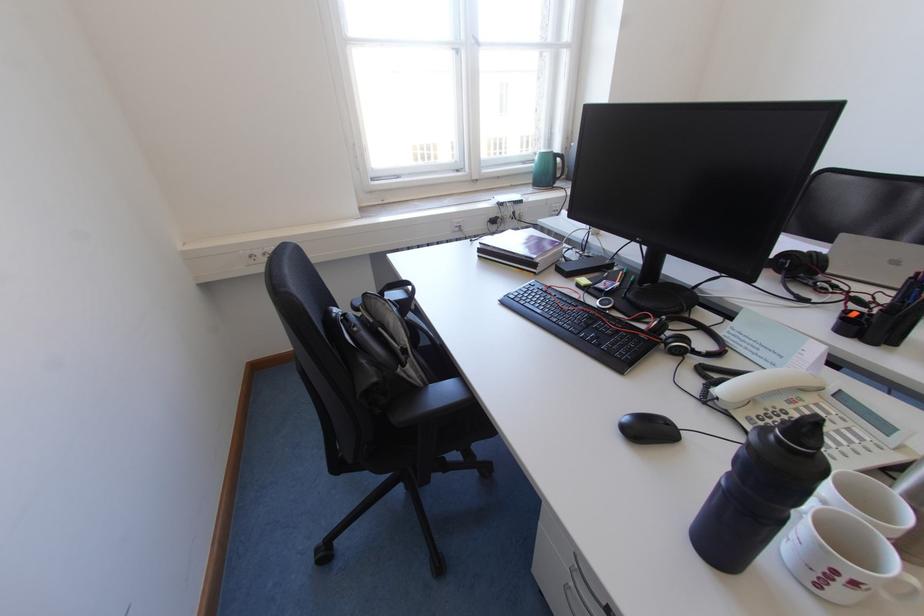
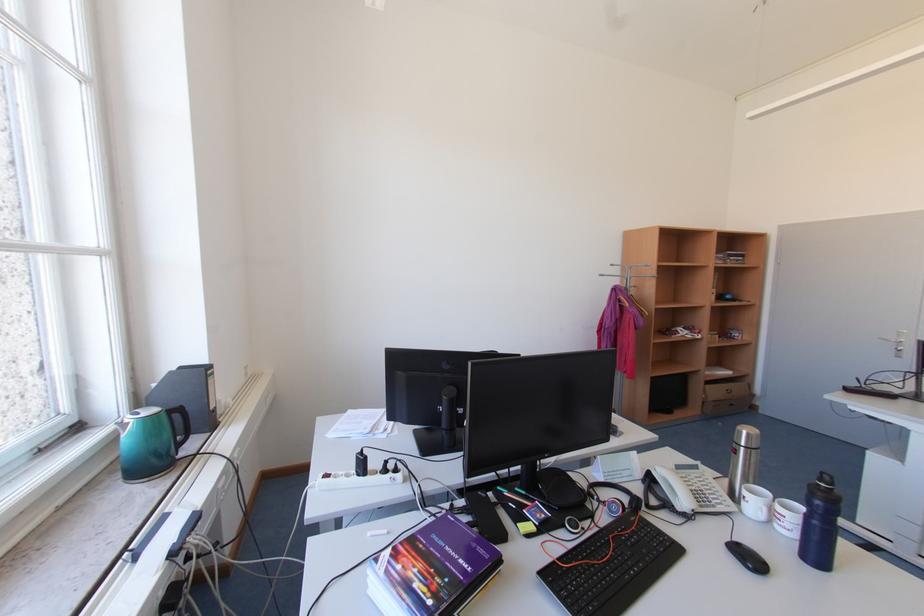
In the second image, find the point that corresponds to pixel 566 161 in the first image.

(185, 416)